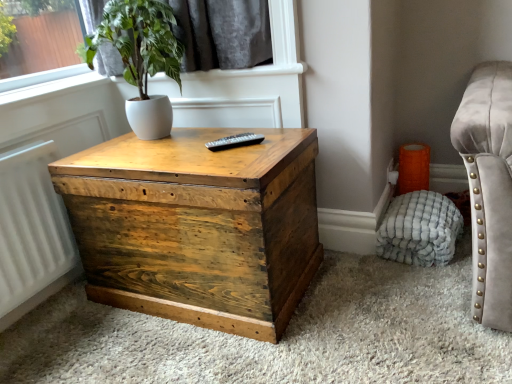
This screenshot has height=384, width=512. I want to click on free space in front of black plastic remote at center, so click(236, 160).